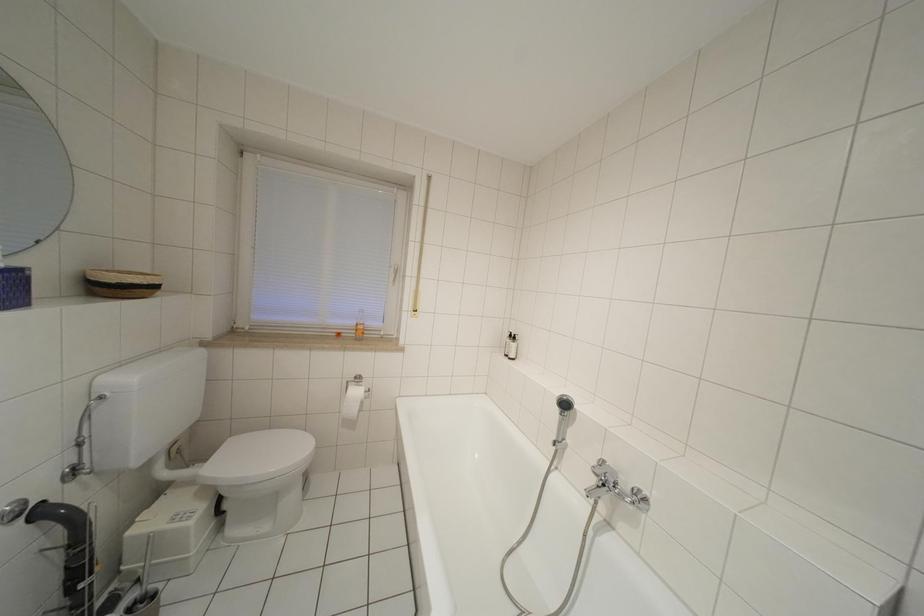
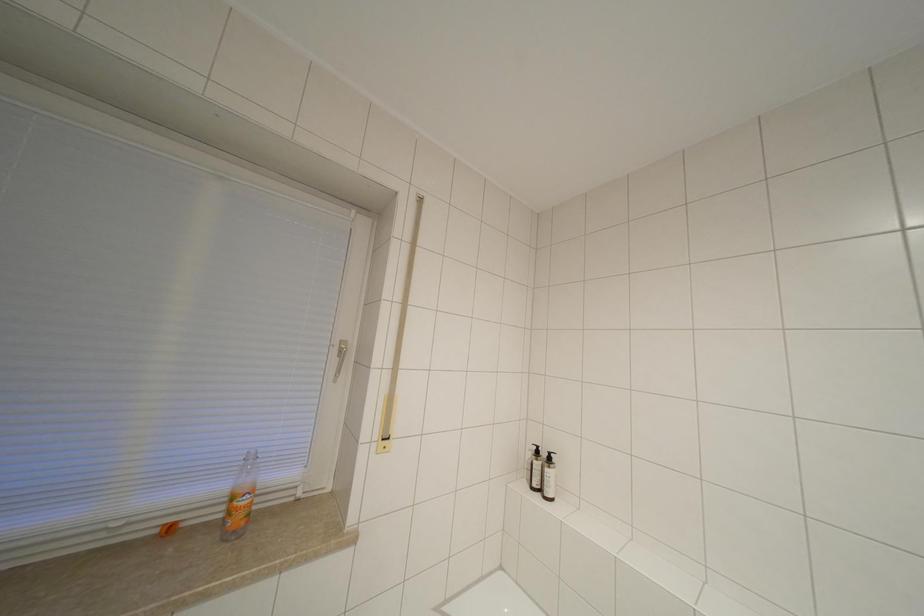
Question: The images are taken continuously from a first-person perspective. In which direction is your viewpoint rotating?

Choices:
 (A) Left
 (B) Right
 (C) Up
 (D) Down

Answer: (B)